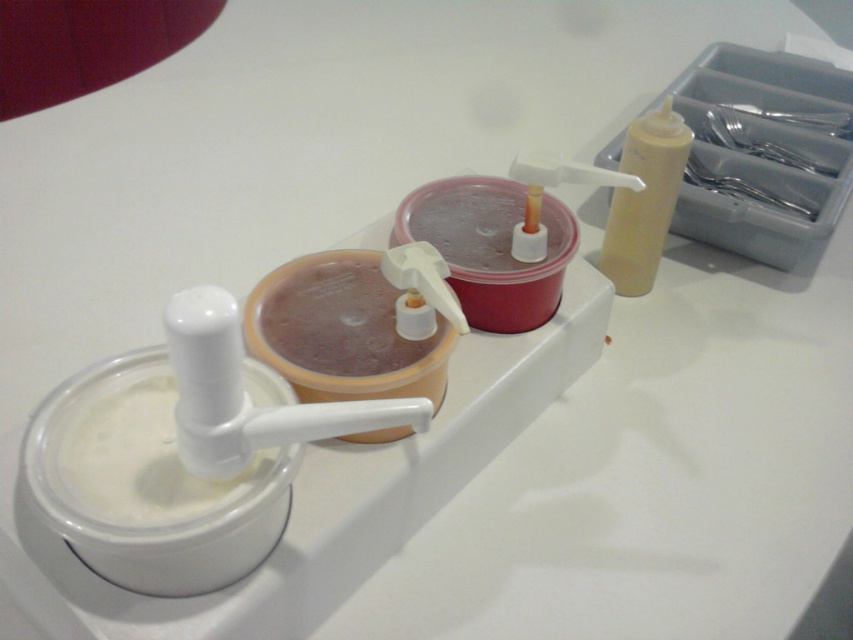
Is point (169, 388) positioned after point (616, 195)?

No, it is in front of (616, 195).

Who is more forward, (229, 500) or (651, 172)?

Positioned in front is point (229, 500).

Describe the element at coordinates (137, 454) in the screenshot. The height and width of the screenshot is (640, 853). I see `white matte milk at lower left` at that location.

Locate an element on the screen. The image size is (853, 640). white matte milk at lower left is located at coordinates (137, 454).